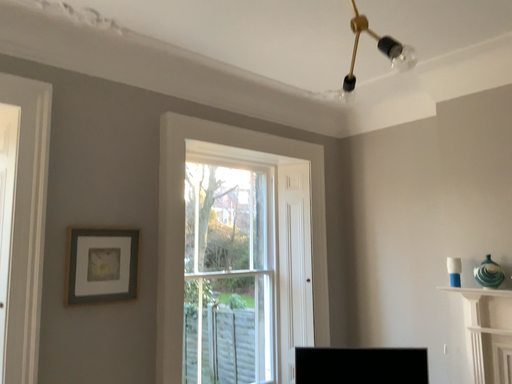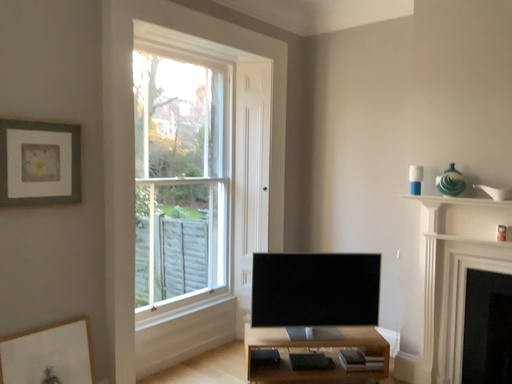
Question: Which way did the camera rotate in the video?

Choices:
 (A) rotated left
 (B) rotated right

Answer: (B)